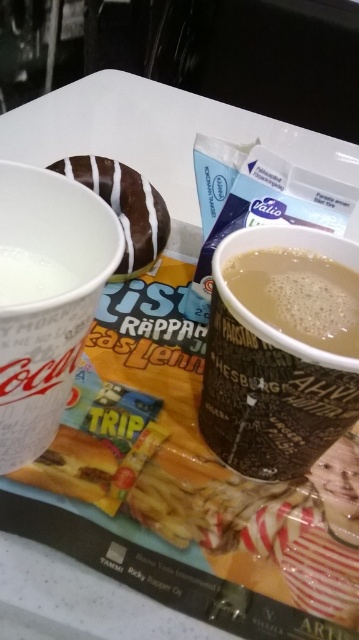
You are at a cafe and want to place a napkin under the white glossy donut at center to prevent it from sliding. The napkin is only large enough to cover an area smaller than the donut. Can you still place the napkin under the donut without it touching the white paper cup at left?

The white paper cup at left is larger than the white glossy donut at center. Since the napkin is smaller than the donut, it might not reach the cup. However, the cup is larger, so placing the napkin under the donut could still leave space between them. But without knowing the exact distance between the cup and donut, it is uncertain if the napkin will touch the cup.

You are a customer at a cafe holding a tray. You want to pick up the white glossy donut at center without moving the brown paper cup at center. Is this possible?

The brown paper cup at center is closer to the viewer than the white glossy donut at center, so you can reach the white glossy donut at center without disturbing the brown paper cup at center by carefully moving your hand around the cup.

You are at a cafe and want to grab the brown paper cup at center and the white glossy donut at center from the tray. Based on their positions, which item is closer to your right hand if you are sitting to the left of the tray?

The brown paper cup at center is to the right of the white glossy donut at center, so it will be closer to your right hand when sitting to the left of the tray.